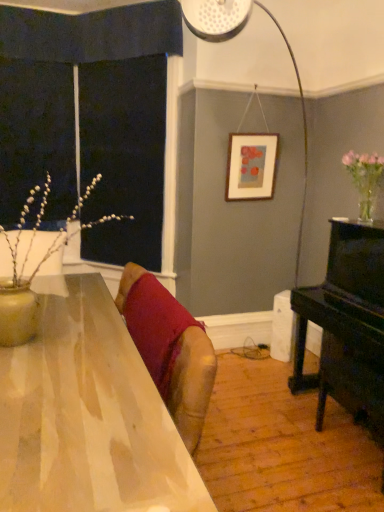
This screenshot has width=384, height=512. I want to click on vacant area on top of matte wooden picture frame at upper center (from a real-world perspective), so click(x=253, y=134).